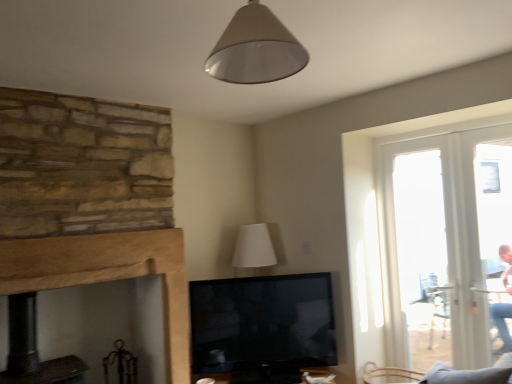
Question: From the image's perspective, is wooden mantle at center located above or below matte beige cone at upper center?

Choices:
 (A) below
 (B) above

Answer: (A)

Question: Is point (165, 221) positioned closer to the camera than point (241, 62)?

Choices:
 (A) farther
 (B) closer

Answer: (A)

Question: Visually, is wooden mantle at center positioned to the left or to the right of matte beige cone at upper center?

Choices:
 (A) right
 (B) left

Answer: (B)

Question: Considering the positions of point click(268, 14) and point click(83, 244), is point click(268, 14) closer or farther from the camera than point click(83, 244)?

Choices:
 (A) farther
 (B) closer

Answer: (B)

Question: In the image, is matte beige cone at upper center on the left side or the right side of wooden mantle at center?

Choices:
 (A) right
 (B) left

Answer: (A)

Question: Is matte beige cone at upper center wider or thinner than wooden mantle at center?

Choices:
 (A) wide
 (B) thin

Answer: (A)

Question: From a real-world perspective, is matte beige cone at upper center above or below wooden mantle at center?

Choices:
 (A) below
 (B) above

Answer: (B)